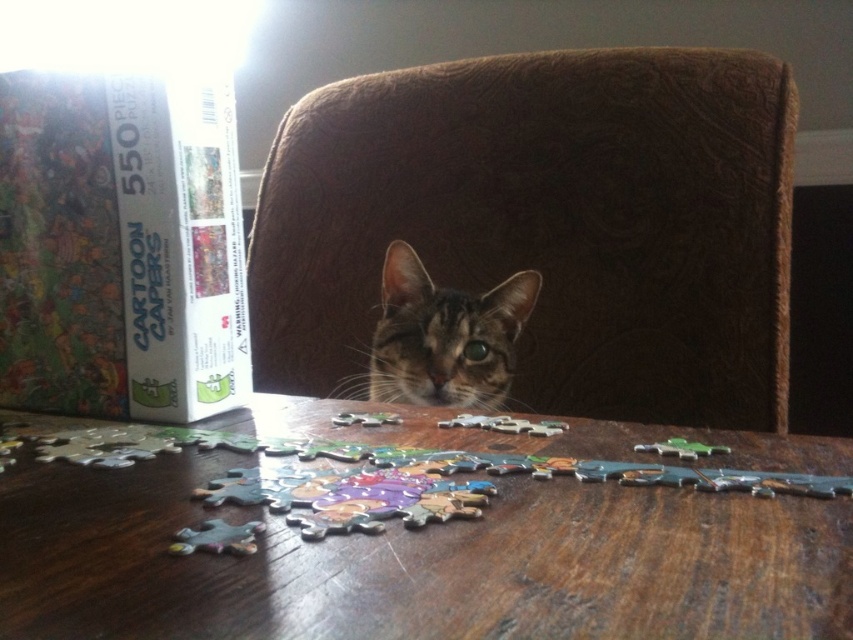
Which is in front, point (277, 417) or point (19, 216)?

Point (19, 216)

Consider the image. Does wooden table at center have a greater height compared to matte cardboard box at left?

No.

Which is in front, point (254, 596) or point (173, 355)?

Point (254, 596) is in front.

In order to click on wooden table at center in this screenshot , I will do `click(421, 564)`.

Based on the photo, is brown velvety chair at center below wooden table at center?

No, brown velvety chair at center is not below wooden table at center.

Who is more distant from viewer, (766, 337) or (143, 582)?

The point (766, 337) is behind.

Locate an element on the screen. The image size is (853, 640). brown velvety chair at center is located at coordinates (546, 225).

Who is positioned more to the right, brown velvety chair at center or tabby fur cat at center?

Positioned to the right is brown velvety chair at center.

Who is more forward, (595, 172) or (461, 340)?

Point (461, 340)

Between point (508, 83) and point (453, 298), which one is positioned in front?

Point (453, 298) is more forward.

Identify the location of brown velvety chair at center. (546, 225).